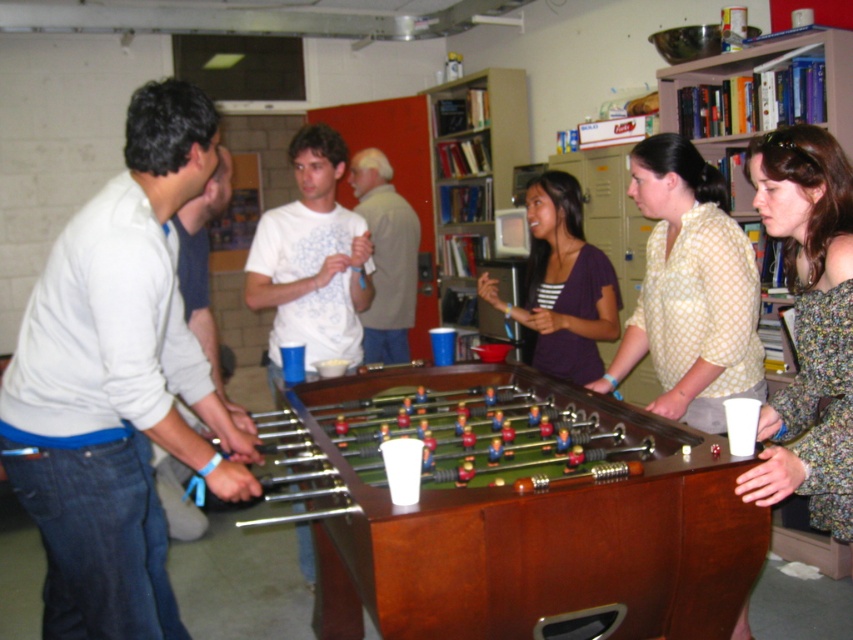
Can you confirm if brown wooden foosball table at center is positioned to the right of wooden bookshelf at upper right?

In fact, brown wooden foosball table at center is to the left of wooden bookshelf at upper right.

Is point (718, 628) in front of point (660, 109)?

Yes, it is.

Is point (514, 474) positioned in front of point (849, 116)?

Yes.

Locate an element on the screen. The height and width of the screenshot is (640, 853). brown wooden foosball table at center is located at coordinates (527, 518).

Is denim jeans at left to the right of green felt table at center from the viewer's perspective?

In fact, denim jeans at left is to the left of green felt table at center.

Does point (178, 380) come in front of point (508, 408)?

Yes, point (178, 380) is in front of point (508, 408).

Between point (164, 436) and point (480, 465), which one is positioned behind?

Point (480, 465)

The height and width of the screenshot is (640, 853). I want to click on denim jeans at left, so click(117, 385).

Between wooden bookshelf at upper center and green felt table at center, which one is positioned higher?

wooden bookshelf at upper center is higher up.

Looking at this image, does wooden bookshelf at upper center have a larger size compared to green felt table at center?

Indeed, wooden bookshelf at upper center has a larger size compared to green felt table at center.

This screenshot has width=853, height=640. What are the coordinates of `wooden bookshelf at upper center` in the screenshot? It's located at (473, 161).